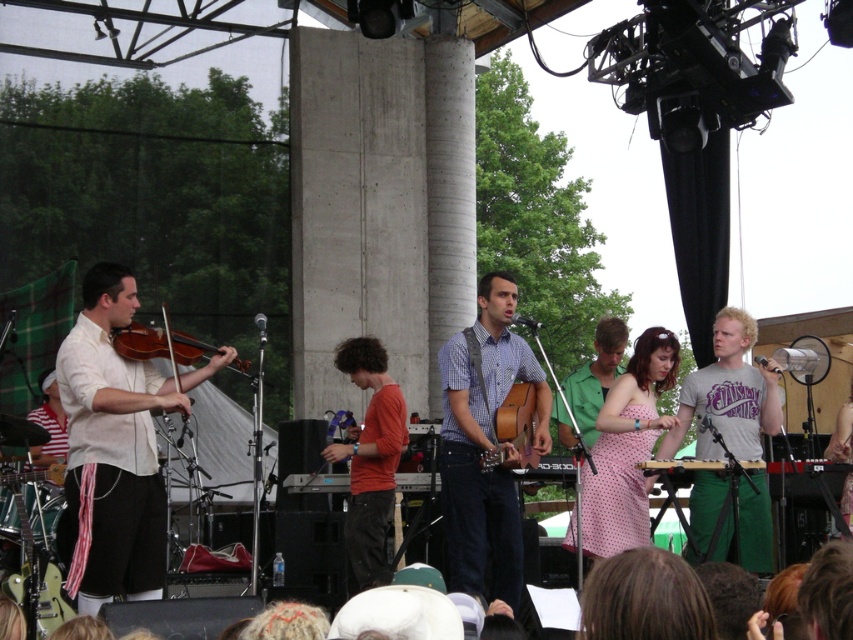
Can you confirm if checkered fabric shirt at center is positioned to the right of brown wooden guitar at center?

No, checkered fabric shirt at center is not to the right of brown wooden guitar at center.

Describe the element at coordinates (485, 442) in the screenshot. I see `checkered fabric shirt at center` at that location.

The width and height of the screenshot is (853, 640). Identify the location of checkered fabric shirt at center. (485, 442).

Which is behind, point (480, 413) or point (202, 344)?

Positioned behind is point (480, 413).

Can you confirm if checkered fabric shirt at center is positioned above matte brown violin at left?

No.

Who is more distant from viewer, (471, 355) or (161, 314)?

Point (161, 314)

Locate an element on the screen. The width and height of the screenshot is (853, 640). checkered fabric shirt at center is located at coordinates (485, 442).

Does checkered fabric shirt at center appear on the right side of green cotton pants at center?

In fact, checkered fabric shirt at center is to the left of green cotton pants at center.

Looking at this image, can you confirm if checkered fabric shirt at center is taller than green cotton pants at center?

Indeed, checkered fabric shirt at center has a greater height compared to green cotton pants at center.

The height and width of the screenshot is (640, 853). What do you see at coordinates (485, 442) in the screenshot?
I see `checkered fabric shirt at center` at bounding box center [485, 442].

This screenshot has height=640, width=853. Identify the location of checkered fabric shirt at center. (485, 442).